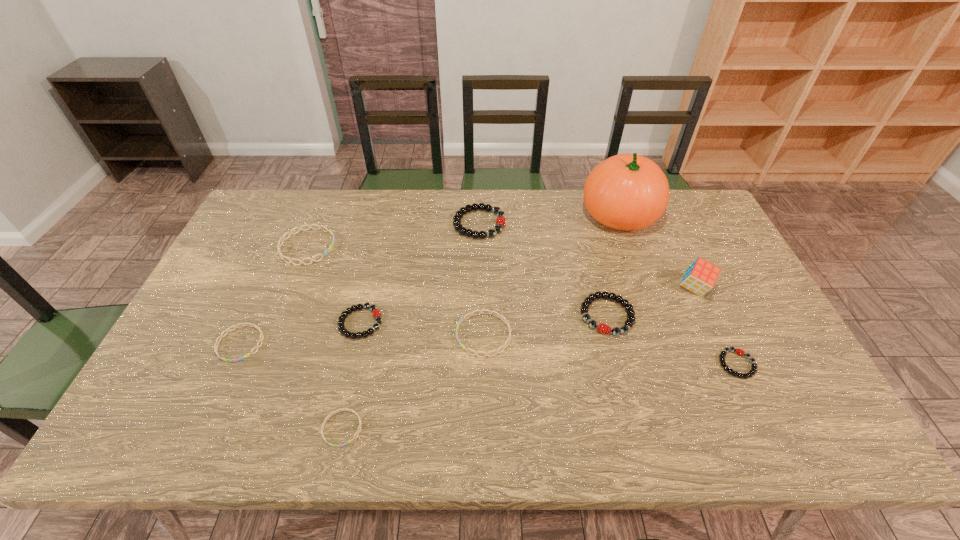
Where is `free region located on the surface of the second biggest blue bracelet showing star-shaped elements`? This screenshot has height=540, width=960. free region located on the surface of the second biggest blue bracelet showing star-shaped elements is located at coordinates (329, 335).

This screenshot has height=540, width=960. I want to click on vacant area located 0.070m on the surface of the second biggest blue bracelet showing star-shaped elements, so click(x=430, y=335).

Where is `free location located on the surface of the second biggest blue bracelet showing star-shaped elements`? free location located on the surface of the second biggest blue bracelet showing star-shaped elements is located at coordinates (370, 335).

Where is `vacant space located on the left of the third biggest black bracelet`? vacant space located on the left of the third biggest black bracelet is located at coordinates (276, 322).

Where is `free space located on the surface of the second smallest blue bracelet showing star-shaped elements`? free space located on the surface of the second smallest blue bracelet showing star-shaped elements is located at coordinates (221, 388).

Where is `vacant region located 0.060m on the front of the rightmost black bracelet`? The image size is (960, 540). vacant region located 0.060m on the front of the rightmost black bracelet is located at coordinates (755, 402).

At what (x,y) coordinates should I click in order to perform the action: click on pumpkin that is at the far edge. Please return your answer as a coordinate pair (x, y). The height and width of the screenshot is (540, 960). Looking at the image, I should click on (627, 192).

Find the location of a particular element. Image resolution: width=960 pixels, height=540 pixels. object that is at the near edge is located at coordinates point(360,423).

The height and width of the screenshot is (540, 960). I want to click on cube at the right edge, so click(x=701, y=276).

Image resolution: width=960 pixels, height=540 pixels. I want to click on bracelet that is at the right edge, so click(738, 351).